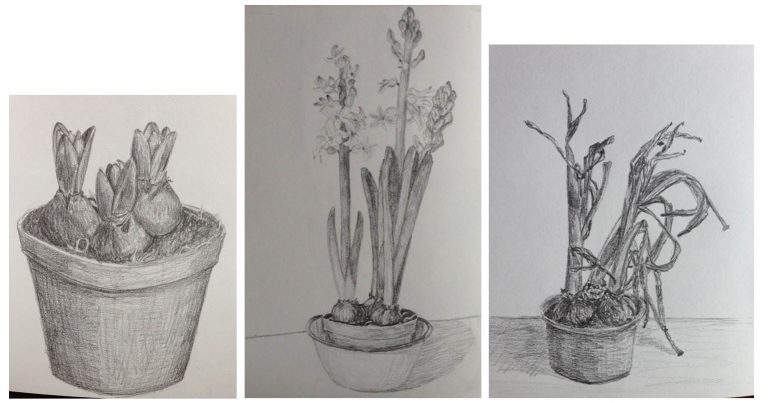
This screenshot has width=768, height=403. What are the coordinates of `medium box` in the screenshot? It's located at (689, 91).